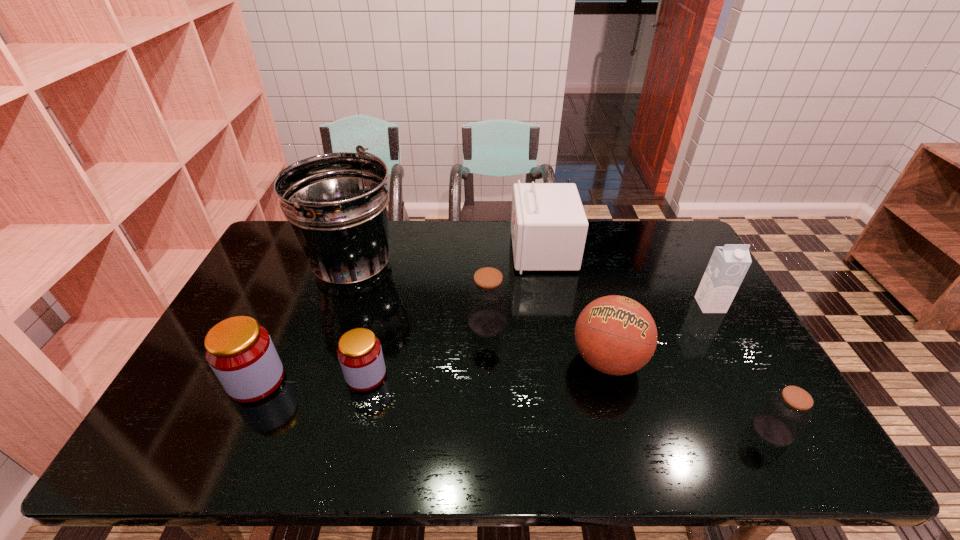
You are a GUI agent. You are given a task and a screenshot of the screen. Output one action in this format:
    pyautogui.click(x=<x>, y=<y>)
    Task: Click on the vacant area between the farther brown jar and the smaller brown jar
    
    Given the screenshot: What is the action you would take?
    tap(630, 376)

Where is `the fourth closest object to the third jar from right to left`? This screenshot has width=960, height=540. the fourth closest object to the third jar from right to left is located at coordinates (616, 335).

I want to click on the fifth closest object to the first-aid kit, so 359,352.

You are a GUI agent. You are given a task and a screenshot of the screen. Output one action in this format:
    pyautogui.click(x=<x>, y=<y>)
    Task: Click on the third closest jar to the rightmost jar
    This screenshot has width=960, height=540.
    Given the screenshot: What is the action you would take?
    tap(240, 352)

Point out which jar is positioned as the third nearest to the left red jar. Please provide its 2D coordinates. Your answer should be formatted as a tuple, i.e. [(x, y)], where the tuple contains the x and y coordinates of a point satisfying the conditions above.

[(785, 413)]

Identify the location of vacant area that satisfies the following two spatial constraints: 1. on the front-facing side of the first-aid kit; 2. on the left side of the nearer brown jar. This screenshot has height=540, width=960. (575, 430).

At what (x,y) coordinates should I click in order to perform the action: click on free space that satisfies the following two spatial constraints: 1. on the front-facing side of the smaller brown jar; 2. on the left side of the first-aid kit. Please return your answer as a coordinate pair (x, y). Looking at the image, I should click on (575, 430).